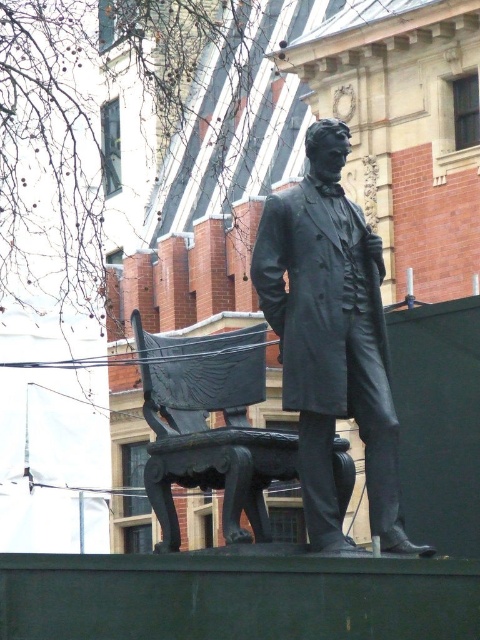
Question: Which object is farther from the camera taking this photo?

Choices:
 (A) matte black statue at center
 (B) black polished wood bench at center

Answer: (B)

Question: Among these objects, which one is nearest to the camera?

Choices:
 (A) black polished wood bench at center
 (B) matte black statue at center

Answer: (B)

Question: Is matte black statue at center above black polished wood bench at center?

Choices:
 (A) no
 (B) yes

Answer: (B)

Question: Is matte black statue at center to the right of black polished wood bench at center from the viewer's perspective?

Choices:
 (A) no
 (B) yes

Answer: (B)

Question: Can you confirm if matte black statue at center is bigger than black polished wood bench at center?

Choices:
 (A) no
 (B) yes

Answer: (A)